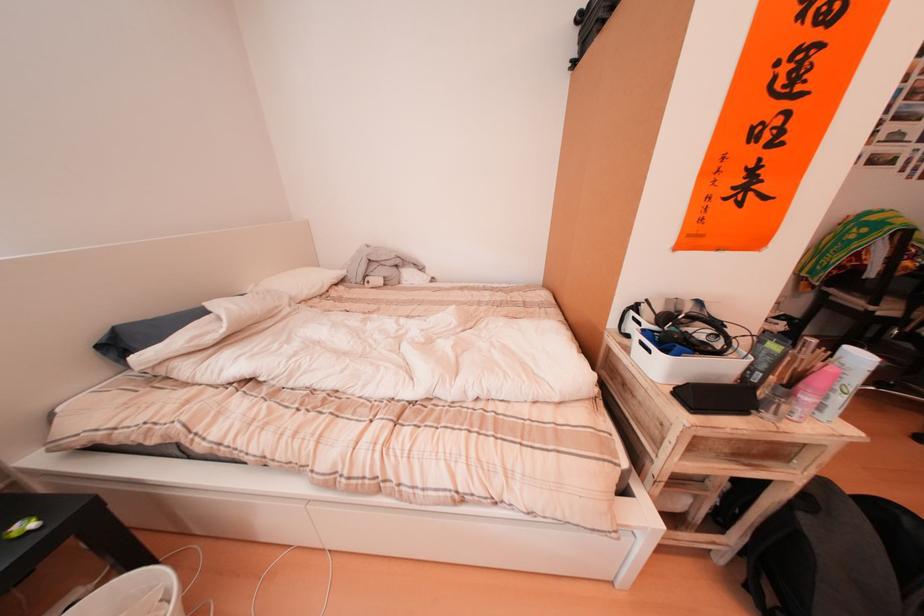
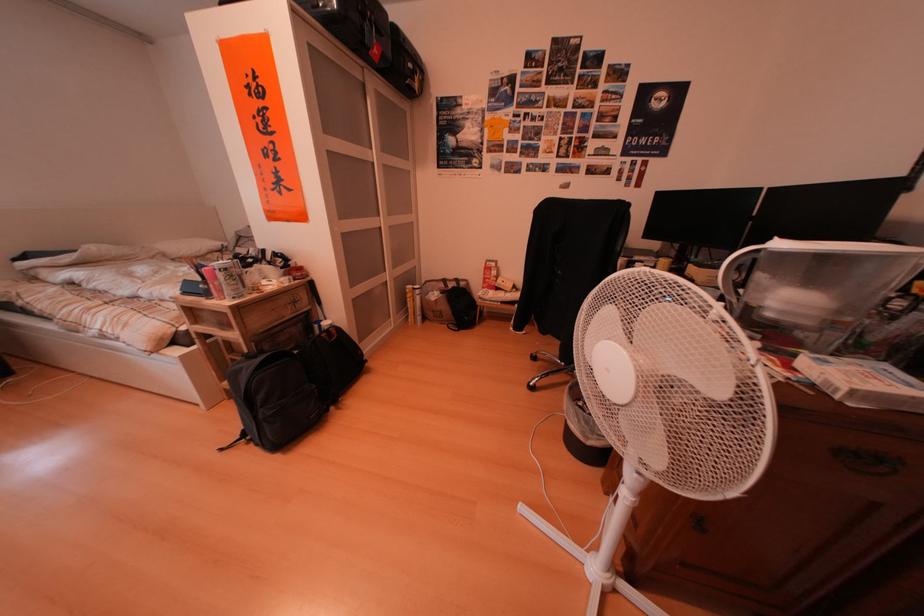
Question: In a continuous first-person perspective shot, in which direction is the camera moving?

Choices:
 (A) Left
 (B) Right
 (C) Forward
 (D) Backward

Answer: (B)